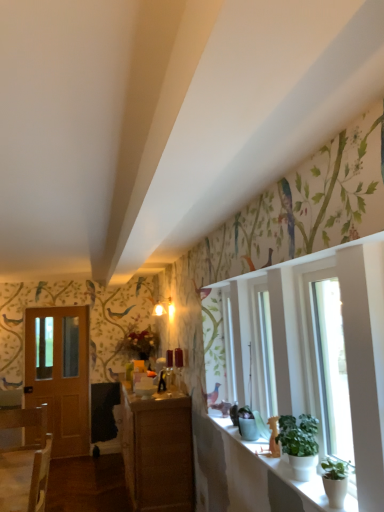
Question: Could wooden door at left be considered to be inside green matte plant at lower right, which appears as the 2th houseplant when viewed from the front?

Choices:
 (A) no
 (B) yes

Answer: (A)

Question: Considering the relative positions of green matte plant at lower right, which is the first houseplant from back to front, and wooden door at left in the image provided, is green matte plant at lower right, which is the first houseplant from back to front, to the left of wooden door at left from the viewer's perspective?

Choices:
 (A) no
 (B) yes

Answer: (A)

Question: Is green matte plant at lower right, which appears as the 2th houseplant when viewed from the front, oriented away from wooden door at left?

Choices:
 (A) yes
 (B) no

Answer: (B)

Question: Are green matte plant at lower right, which appears as the 2th houseplant when viewed from the front, and wooden door at left located far from each other?

Choices:
 (A) no
 (B) yes

Answer: (B)

Question: Does green matte plant at lower right, which appears as the 2th houseplant when viewed from the front, have a larger size compared to wooden door at left?

Choices:
 (A) no
 (B) yes

Answer: (A)

Question: Is green matte plant at lower right, which is the first houseplant from back to front, behind wooden door at left?

Choices:
 (A) no
 (B) yes

Answer: (A)

Question: Is green matte plant at lower right, the 1th houseplant positioned from the front, turned away from transparent glass window at right?

Choices:
 (A) no
 (B) yes

Answer: (B)

Question: Is green matte plant at lower right, the 1th houseplant positioned from the front, thinner than transparent glass window at right?

Choices:
 (A) yes
 (B) no

Answer: (A)

Question: Would you say green matte plant at lower right, the 1th houseplant positioned from the front, contains transparent glass window at right?

Choices:
 (A) yes
 (B) no

Answer: (B)

Question: From a real-world perspective, is green matte plant at lower right, the 1th houseplant positioned from the front, positioned under transparent glass window at right based on gravity?

Choices:
 (A) no
 (B) yes

Answer: (B)

Question: Is green matte plant at lower right, the second houseplant from the back, at the left side of transparent glass window at right?

Choices:
 (A) yes
 (B) no

Answer: (A)

Question: Can you confirm if green matte plant at lower right, the second houseplant from the back, is wider than transparent glass window at right?

Choices:
 (A) no
 (B) yes

Answer: (A)

Question: From the image's perspective, is transparent glass window at right above white ceramic window sill at lower right?

Choices:
 (A) yes
 (B) no

Answer: (A)